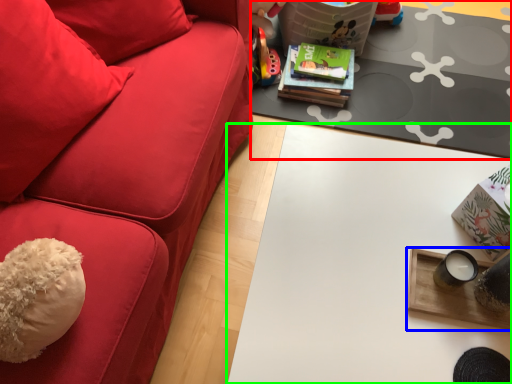
Question: Which object is the closest to the table (highlighted by a red box)? Choose among these: table (highlighted by a blue box) or table (highlighted by a green box).

Choices:
 (A) table
 (B) table

Answer: (B)